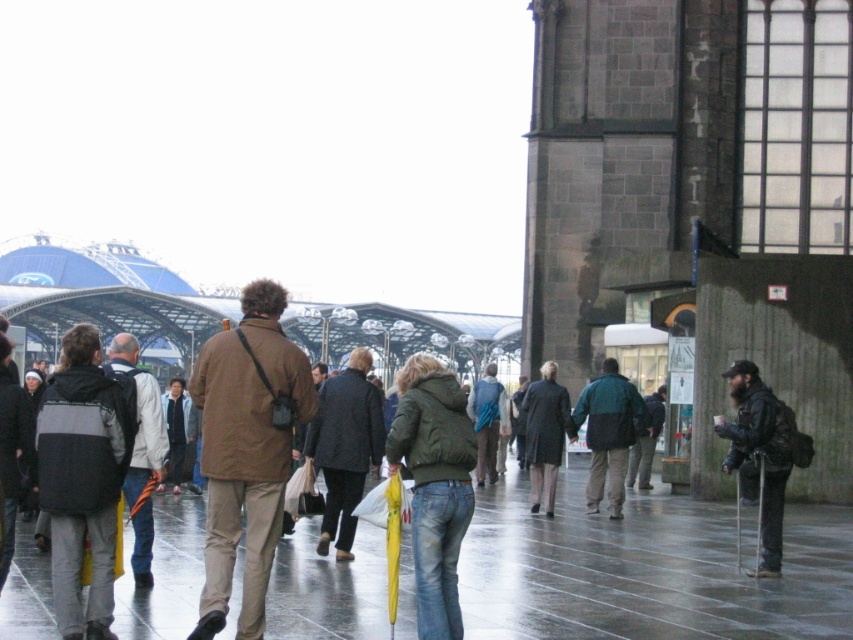
Is green matte jacket at center to the right of teal-green jacket at center from the viewer's perspective?

In fact, green matte jacket at center is to the left of teal-green jacket at center.

Is green matte jacket at center wider than teal-green jacket at center?

No, green matte jacket at center is not wider than teal-green jacket at center.

Does point (405, 397) come farther from viewer compared to point (606, 456)?

No.

Find the location of `green matte jacket at center`. green matte jacket at center is located at coordinates (434, 484).

Who is lower down, green matte jacket at center or dark green jacket at center?

dark green jacket at center is lower down.

Between point (431, 406) and point (627, 476), which one is positioned in front?

Point (431, 406)

Who is more forward, (x=459, y=480) or (x=654, y=403)?

Point (x=459, y=480) is in front.

You are a GUI agent. You are given a task and a screenshot of the screen. Output one action in this format:
    pyautogui.click(x=<x>, y=<y>)
    Task: Click on the green matte jacket at center
    This screenshot has height=640, width=853.
    Given the screenshot: What is the action you would take?
    pyautogui.click(x=434, y=484)

Does brown matte jacket at center have a lesser width compared to black matte jacket at left?

No.

Which of these two, brown matte jacket at center or black matte jacket at left, stands shorter?

Standing shorter between the two is black matte jacket at left.

Who is more forward, (x=204, y=342) or (x=62, y=524)?

Point (x=62, y=524)

This screenshot has width=853, height=640. I want to click on brown matte jacket at center, so click(247, 451).